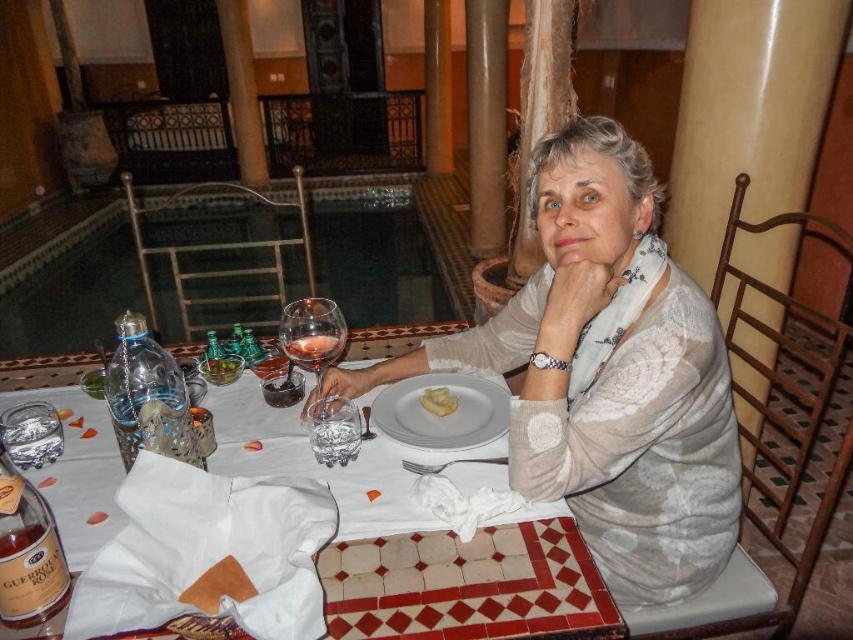
You are a server at a high end restaurant. You need to place a new dessert menu on the table between the white lace shirt at center and the white matte plate at center. According to the arrangement, where should you place it?

The white lace shirt at center is to the right of the white matte plate at center, so you should place the dessert menu between them to the left of the white lace shirt at center and to the right of the white matte plate at center.

You are a waiter in a fancy restaurant and need to serve a customer. There are two glasses on the table, a transparent glass pool at center and a clear glass at table center. Which glass should you use to pour the wine?

The transparent glass pool at center has a larger size compared to the clear glass at table center, so you should pour the wine into the transparent glass pool at center.

You are a waiter in a fancy restaurant and need to place a new menu between the white lace shirt at center and the white matte plate at center on the table. The menu is 20 centimeters wide. Can you fit it between them without moving either the shirt or the plate?

The distance between the white lace shirt at center and the white matte plate at center is 22.93 centimeters. Since the menu is only 20 centimeters wide, there is enough space to place it between them without moving either object.